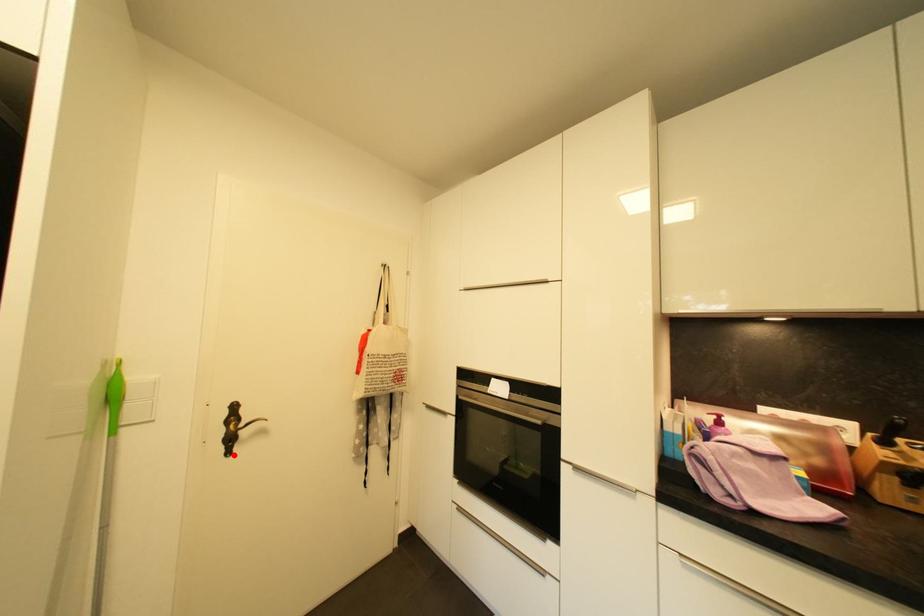
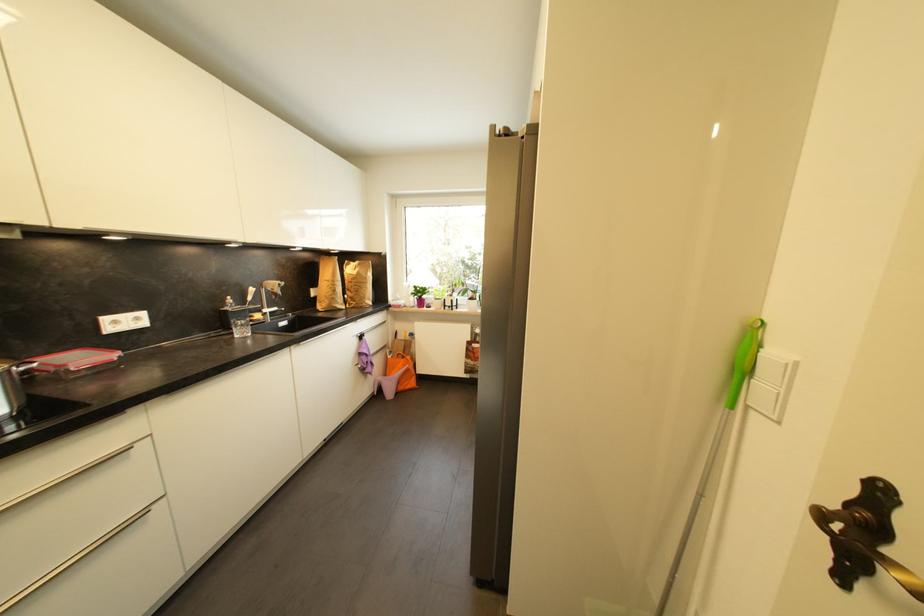
Question: I am providing you with two images of the same scene from different viewpoints. A red point is marked on the first image. At the location where the point appears in image 1, is it still visible in image 2?

Choices:
 (A) Yes
 (B) No

Answer: (A)